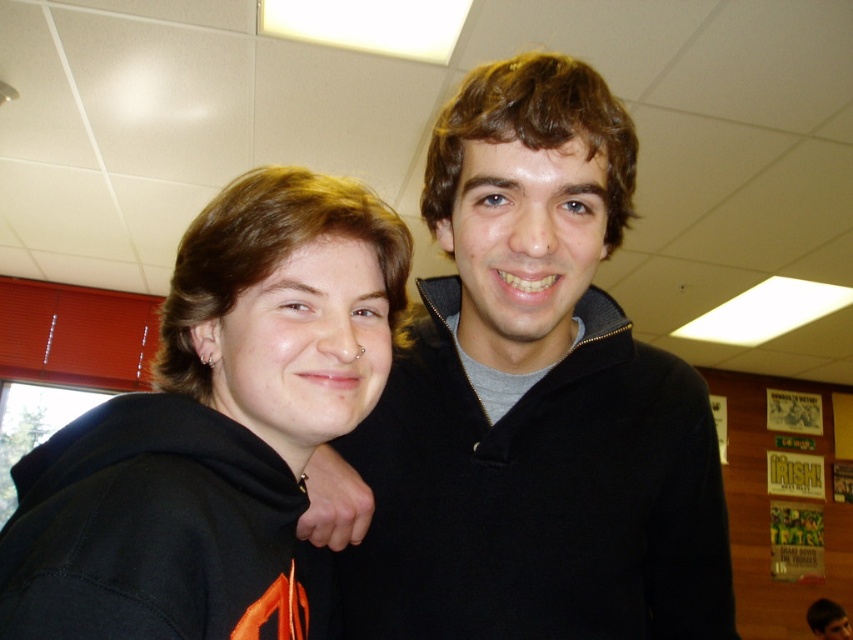
Who is positioned more to the left, black hoodie at left or black matte hoodie at center?

black hoodie at left

At what (x,y) coordinates should I click in order to perform the action: click on black hoodie at left. Please return your answer as a coordinate pair (x, y). This screenshot has height=640, width=853. Looking at the image, I should click on (213, 428).